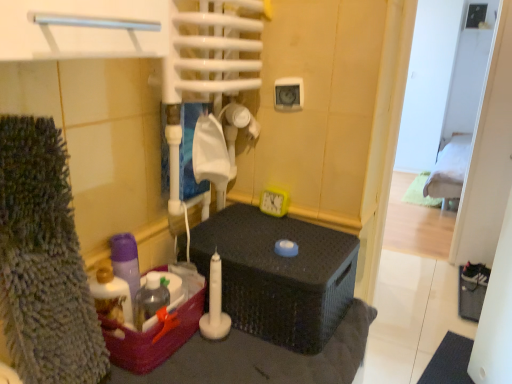
Identify the location of unoccupied region to the right of translucent plastic basket at lower left. This screenshot has width=512, height=384. (229, 358).